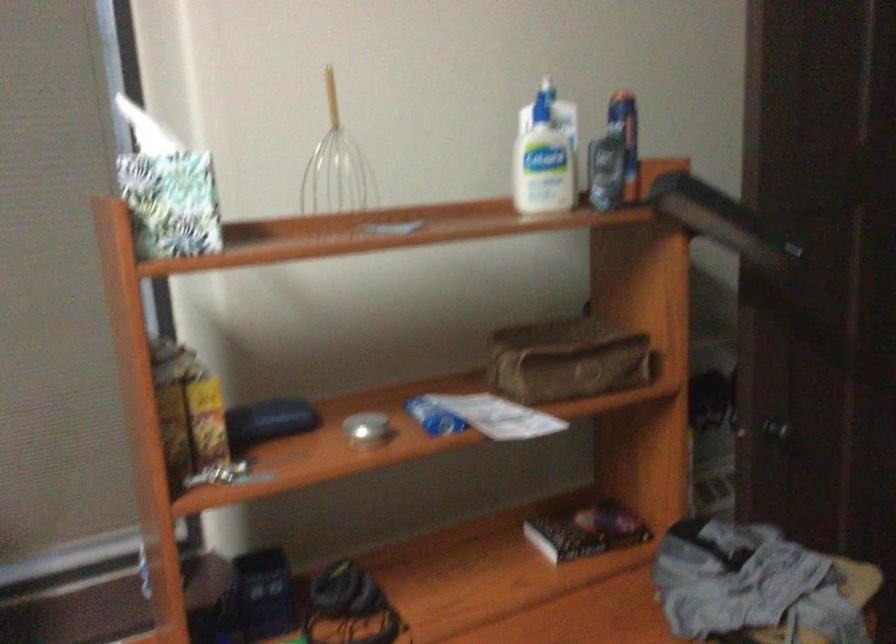
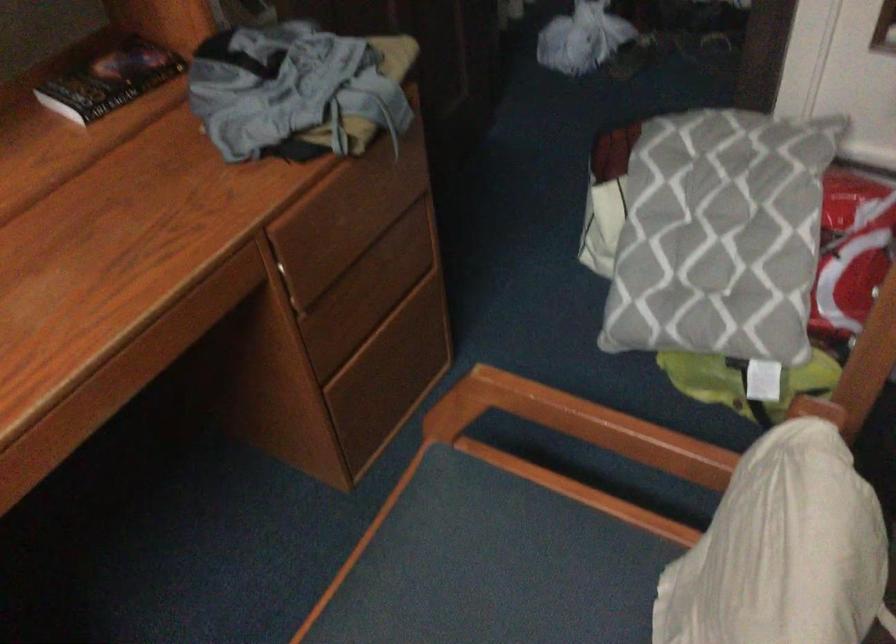
Find the pixel in the second image that matches the point at 582,529 in the first image.

(110, 80)